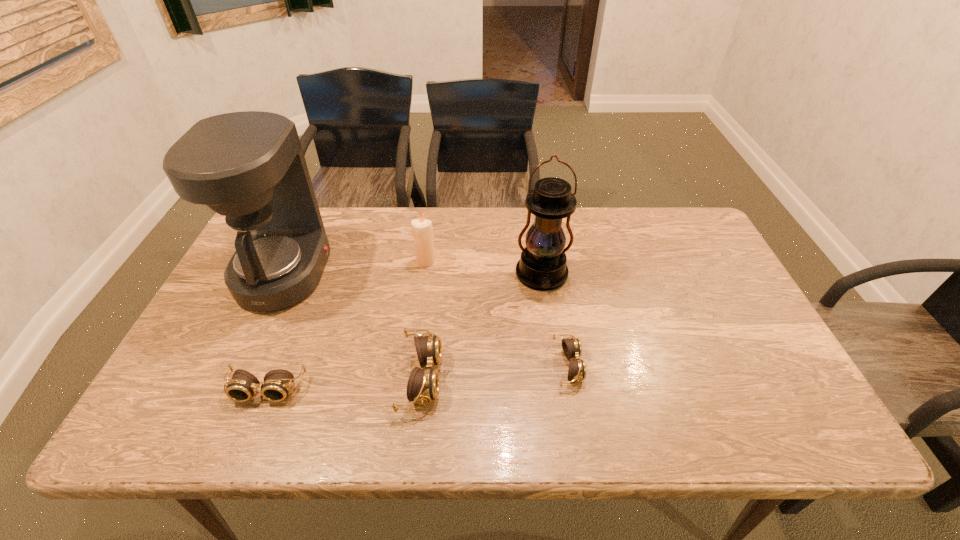
The image size is (960, 540). Identify the location of vacant space located 0.350m through the lenses of the shortest object. (728, 366).

Locate an element on the screen. The image size is (960, 540). free space located 0.320m on the button side of the coffee maker is located at coordinates (437, 273).

Image resolution: width=960 pixels, height=540 pixels. What are the coordinates of `vacant space located on the right of the third tallest object` in the screenshot? It's located at (472, 261).

Where can I find a free point located 0.230m above the lantern, indicating its light source? Please provide its 2D coordinates. Your answer should be formatted as a tuple, i.e. [(x, y)], where the tuple contains the x and y coordinates of a point satisfying the conditions above.

[(555, 365)]

I want to click on object that is at the far edge, so click(x=249, y=166).

The image size is (960, 540). I want to click on goggles that is at the left edge, so pyautogui.click(x=277, y=383).

Image resolution: width=960 pixels, height=540 pixels. I want to click on coffee maker that is at the left edge, so click(x=249, y=166).

Identify the location of object positioned at the far left corner. (249, 166).

Locate an element on the screen. object positioned at the near left corner is located at coordinates (277, 383).

The image size is (960, 540). Find the location of `vacant space at the far edge of the desktop`. vacant space at the far edge of the desktop is located at coordinates (332, 226).